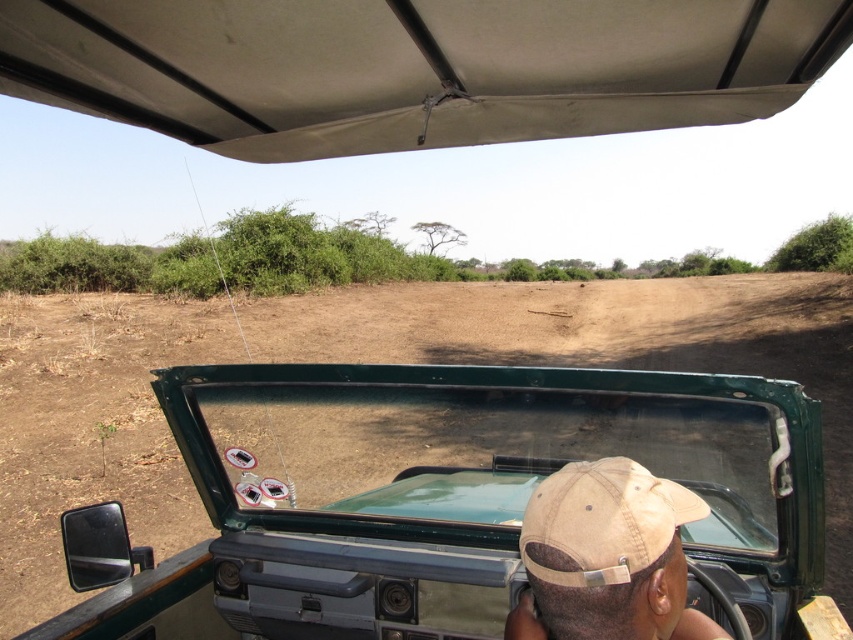
Question: Does beige fabric canopy at upper center appear over tan fabric baseball cap at center?

Choices:
 (A) yes
 (B) no

Answer: (A)

Question: Among these objects, which one is nearest to the camera?

Choices:
 (A) green matte vehicle at center
 (B) tan fabric baseball cap at center

Answer: (B)

Question: From the image, what is the correct spatial relationship of green matte vehicle at center in relation to tan fabric baseball cap at center?

Choices:
 (A) above
 (B) below

Answer: (B)

Question: Which object is farther from the camera taking this photo?

Choices:
 (A) tan fabric baseball cap at center
 (B) green matte vehicle at center

Answer: (B)

Question: Does beige fabric canopy at upper center have a larger size compared to tan fabric baseball cap at center?

Choices:
 (A) yes
 (B) no

Answer: (A)

Question: Which point is closer to the camera?

Choices:
 (A) green matte vehicle at center
 (B) beige fabric canopy at upper center
 (C) tan fabric baseball cap at center

Answer: (C)